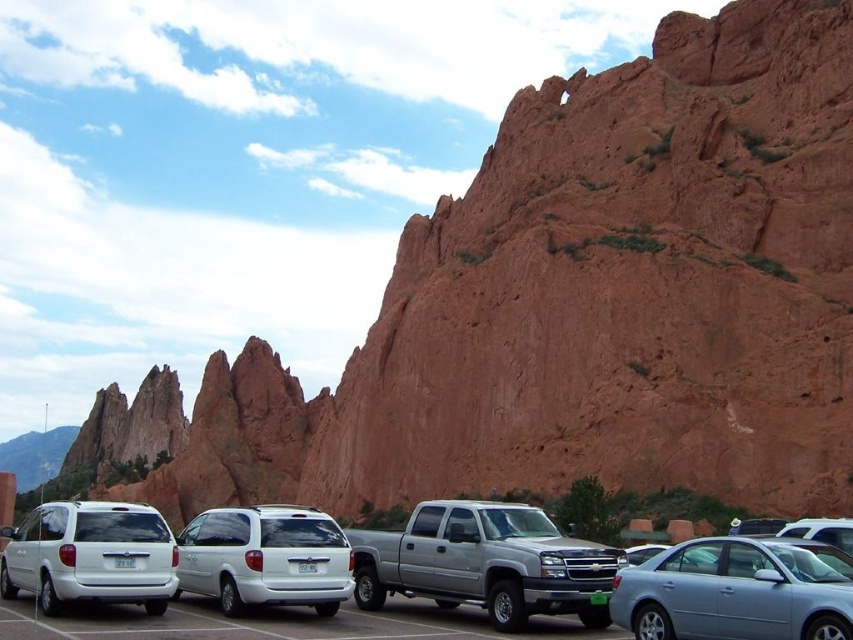
Describe the element at coordinates (486, 563) in the screenshot. I see `silver metallic truck at center` at that location.

The image size is (853, 640). I want to click on silver metallic truck at center, so click(486, 563).

Between silver metallic truck at center and white matte van at lower left, which one is positioned higher?

white matte van at lower left is above.

Can you confirm if silver metallic truck at center is positioned to the left of white matte van at lower left?

No, silver metallic truck at center is not to the left of white matte van at lower left.

Is point (444, 561) closer to camera compared to point (26, 557)?

No, it is behind (26, 557).

I want to click on silver metallic truck at center, so click(x=486, y=563).

Does silver metallic truck at center have a greater width compared to satin silver sedan at lower right?

Correct, the width of silver metallic truck at center exceeds that of satin silver sedan at lower right.

The image size is (853, 640). Describe the element at coordinates (486, 563) in the screenshot. I see `silver metallic truck at center` at that location.

Identify the location of silver metallic truck at center. (486, 563).